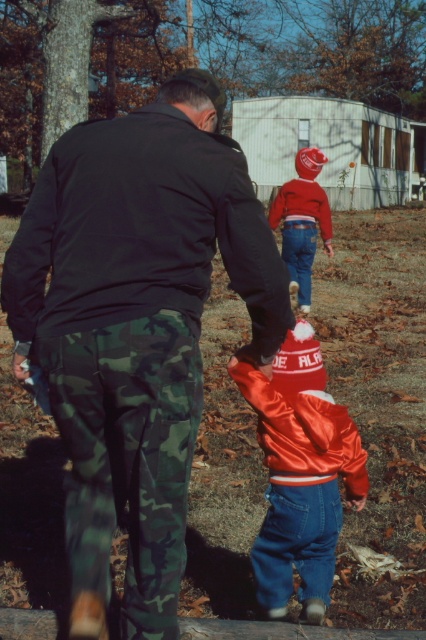
Can you confirm if satin red jacket at lower center is positioned to the right of shiny red jacket at upper center?

In fact, satin red jacket at lower center is to the left of shiny red jacket at upper center.

Measure the distance between satin red jacket at lower center and shiny red jacket at upper center.

satin red jacket at lower center is 6.34 meters away from shiny red jacket at upper center.

What are the coordinates of `satin red jacket at lower center` in the screenshot? It's located at (301, 474).

This screenshot has height=640, width=426. In order to click on satin red jacket at lower center in this screenshot , I will do `click(301, 474)`.

Which is more to the left, camouflage pants at center or shiny red jacket at upper center?

From the viewer's perspective, camouflage pants at center appears more on the left side.

Is the position of camouflage pants at center less distant than that of shiny red jacket at upper center?

Yes, it is in front of shiny red jacket at upper center.

What do you see at coordinates (137, 326) in the screenshot?
I see `camouflage pants at center` at bounding box center [137, 326].

Find the location of a particular element. The width and height of the screenshot is (426, 640). camouflage pants at center is located at coordinates (137, 326).

Can you confirm if shiny red jacket at center is bigger than shiny red jacket at upper center?

Indeed, shiny red jacket at center has a larger size compared to shiny red jacket at upper center.

Locate an element on the screen. This screenshot has width=426, height=640. shiny red jacket at center is located at coordinates (302, 221).

Who is more distant from viewer, (298,196) or (293,216)?

Positioned behind is point (293,216).

Identify the location of shiny red jacket at center. Image resolution: width=426 pixels, height=640 pixels. (302, 221).